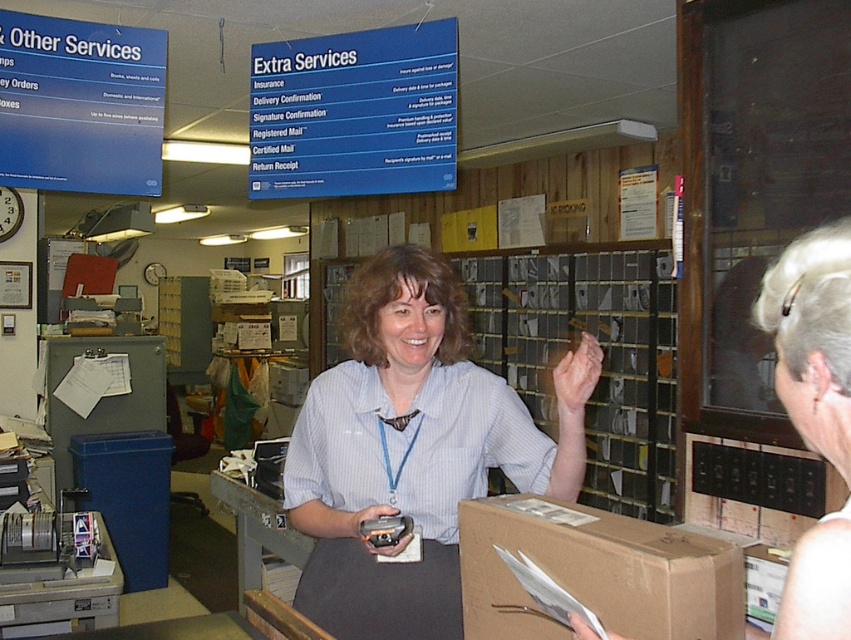
Who is positioned more to the right, white striped shirt at center or brown cardboard box at lower center?

brown cardboard box at lower center is more to the right.

Locate an element on the screen. Image resolution: width=851 pixels, height=640 pixels. white striped shirt at center is located at coordinates (413, 449).

The width and height of the screenshot is (851, 640). What are the coordinates of `white striped shirt at center` in the screenshot? It's located at (413, 449).